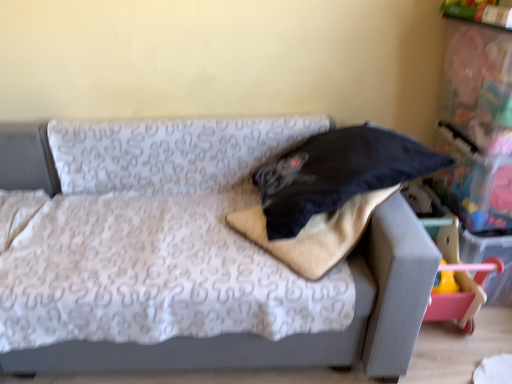
Question: Is black fabric pillow at center facing towards textured gray couch at center?

Choices:
 (A) no
 (B) yes

Answer: (B)

Question: From the image's perspective, is black fabric pillow at center located above textured gray couch at center?

Choices:
 (A) yes
 (B) no

Answer: (A)

Question: Is black fabric pillow at center further to camera compared to textured gray couch at center?

Choices:
 (A) yes
 (B) no

Answer: (A)

Question: Is black fabric pillow at center bigger than textured gray couch at center?

Choices:
 (A) yes
 (B) no

Answer: (B)

Question: Can you confirm if black fabric pillow at center is positioned to the left of textured gray couch at center?

Choices:
 (A) yes
 (B) no

Answer: (B)

Question: Does black fabric pillow at center have a greater height compared to textured gray couch at center?

Choices:
 (A) yes
 (B) no

Answer: (B)

Question: Is textured gray couch at center not within black fabric pillow at center?

Choices:
 (A) no
 (B) yes

Answer: (B)

Question: From a real-world perspective, is textured gray couch at center located beneath black fabric pillow at center?

Choices:
 (A) no
 (B) yes

Answer: (B)

Question: Is textured gray couch at center taller than black fabric pillow at center?

Choices:
 (A) yes
 (B) no

Answer: (A)

Question: Is there a large distance between textured gray couch at center and black fabric pillow at center?

Choices:
 (A) no
 (B) yes

Answer: (A)

Question: Considering the relative sizes of textured gray couch at center and black fabric pillow at center in the image provided, is textured gray couch at center bigger than black fabric pillow at center?

Choices:
 (A) yes
 (B) no

Answer: (A)

Question: Is textured gray couch at center placed right next to black fabric pillow at center?

Choices:
 (A) yes
 (B) no

Answer: (B)

Question: Considering the positions of textured gray couch at center and black fabric pillow at center in the image, is textured gray couch at center wider or thinner than black fabric pillow at center?

Choices:
 (A) thin
 (B) wide

Answer: (B)